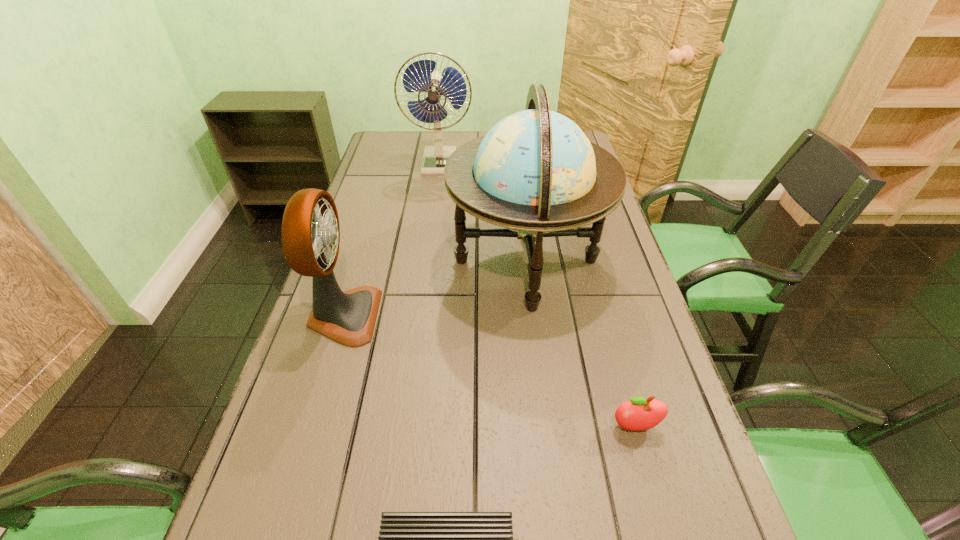
Find the location of a particular element. the tallest object is located at coordinates (535, 173).

Locate an element on the screen. The height and width of the screenshot is (540, 960). the farther fan is located at coordinates (419, 77).

Where is `the third shortest object`? The height and width of the screenshot is (540, 960). the third shortest object is located at coordinates [310, 232].

Identify the location of the shorter fan. This screenshot has width=960, height=540. (310, 232).

Where is `the fourth tallest object`? the fourth tallest object is located at coordinates (638, 414).

You are a GUI agent. You are given a task and a screenshot of the screen. Output one action in this format:
    pyautogui.click(x=<x>, y=<y>)
    Task: Click on the apple
    This screenshot has height=540, width=960.
    Given the screenshot: What is the action you would take?
    pyautogui.click(x=638, y=414)

Find the location of `free space located 0.210m on the surface of the globe`. free space located 0.210m on the surface of the globe is located at coordinates (371, 261).

Identify the location of free spot located on the surface of the globe. (360, 261).

Where is `vacant point located on the surface of the globe`? vacant point located on the surface of the globe is located at coordinates (423, 261).

Where is `free spot located on the front-facing side of the farther fan`? The width and height of the screenshot is (960, 540). free spot located on the front-facing side of the farther fan is located at coordinates (436, 192).